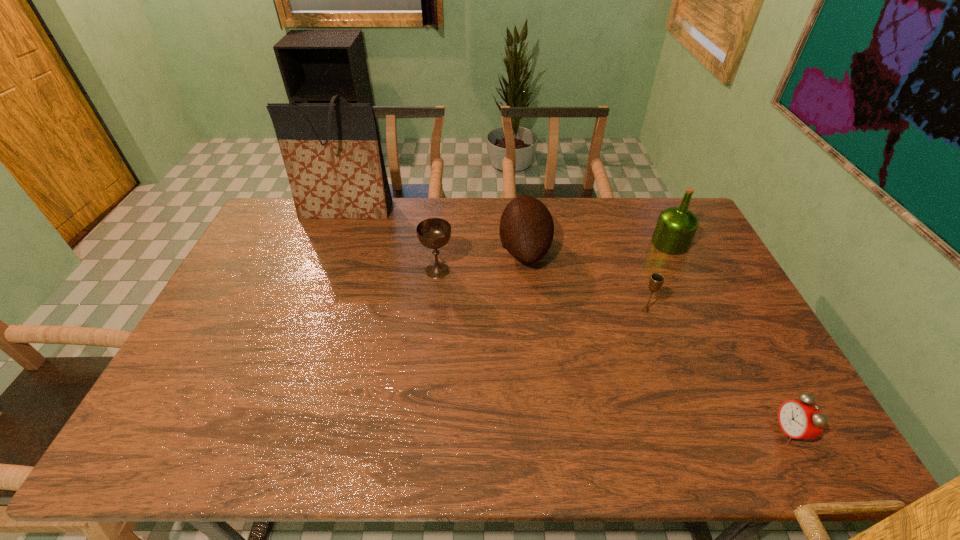
Locate an element on the screen. The width and height of the screenshot is (960, 540). shopping bag is located at coordinates (332, 153).

Image resolution: width=960 pixels, height=540 pixels. I want to click on the leftmost object, so [x=332, y=153].

Identify the location of olive oil. The image size is (960, 540). (676, 226).

Where is `football`? This screenshot has width=960, height=540. football is located at coordinates (526, 231).

Where is `the second object from left to right`? Image resolution: width=960 pixels, height=540 pixels. the second object from left to right is located at coordinates (433, 233).

Find the location of a particular element. This screenshot has height=540, width=960. the farther chalice is located at coordinates (433, 233).

Locate an element on the screen. The height and width of the screenshot is (540, 960). the third object from right to left is located at coordinates (656, 280).

Find the location of a particular element. The width and height of the screenshot is (960, 540). the nearer chalice is located at coordinates (656, 280).

Locate an element on the screen. This screenshot has width=960, height=540. the shortest object is located at coordinates (798, 419).

This screenshot has width=960, height=540. What are the coordinates of `the nearest object` in the screenshot? It's located at (798, 419).